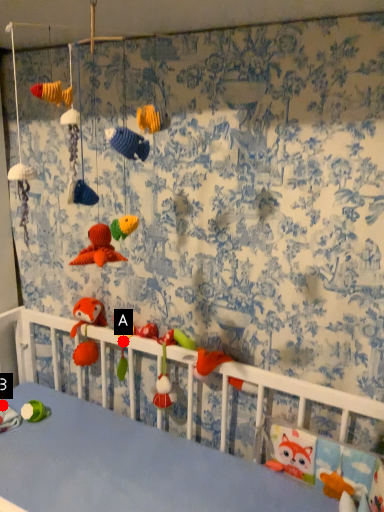
Question: Two points are circled on the image, labeled by A and B beside each circle. Which point is farther from the camera taking this photo?

Choices:
 (A) A is further
 (B) B is further

Answer: (B)